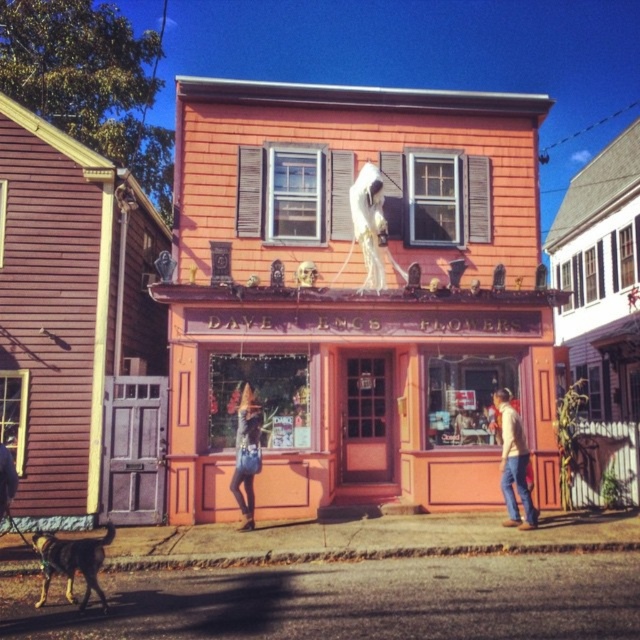
Question: In this image, where is matte pink building at center located relative to denim jacket at center?

Choices:
 (A) right
 (B) left

Answer: (A)

Question: Which of the following is the farthest from the observer?

Choices:
 (A) matte pink building at center
 (B) black fur dog at lower left
 (C) light brown leather jacket at lower right

Answer: (A)

Question: Which point is closer to the camera taking this photo?

Choices:
 (A) (476, 461)
 (B) (508, 433)
 (C) (74, 576)

Answer: (C)

Question: Is matte pink building at center thinner than black fur dog at lower left?

Choices:
 (A) yes
 (B) no

Answer: (B)

Question: Does matte pink building at center appear under black fur dog at lower left?

Choices:
 (A) no
 (B) yes

Answer: (A)

Question: Which of the following is the closest to the observer?

Choices:
 (A) light brown leather jacket at lower right
 (B) matte pink building at center

Answer: (A)